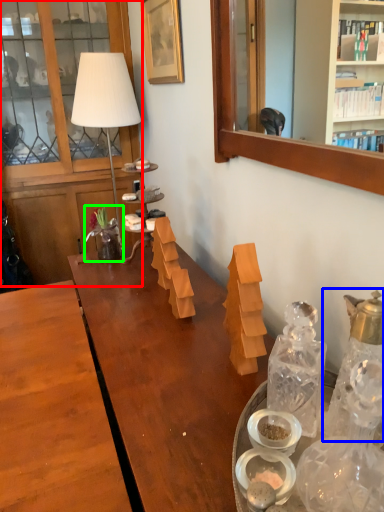
Question: Which is farther away from cabinetry (highlighted by a red box)? bottle (highlighted by a blue box) or flower (highlighted by a green box)?

Choices:
 (A) bottle
 (B) flower

Answer: (A)